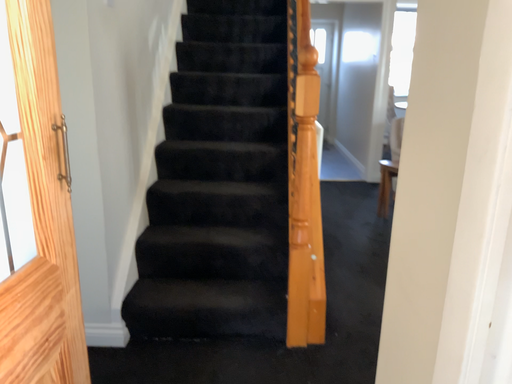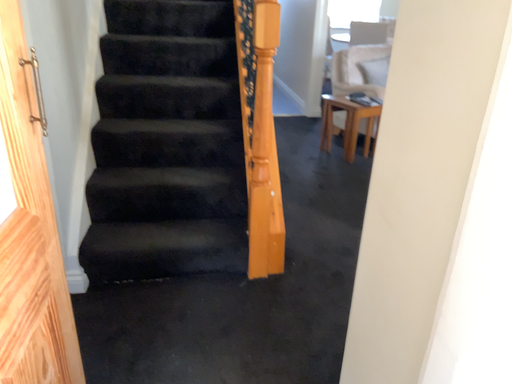
Question: Which way did the camera rotate in the video?

Choices:
 (A) rotated upward
 (B) rotated downward

Answer: (B)